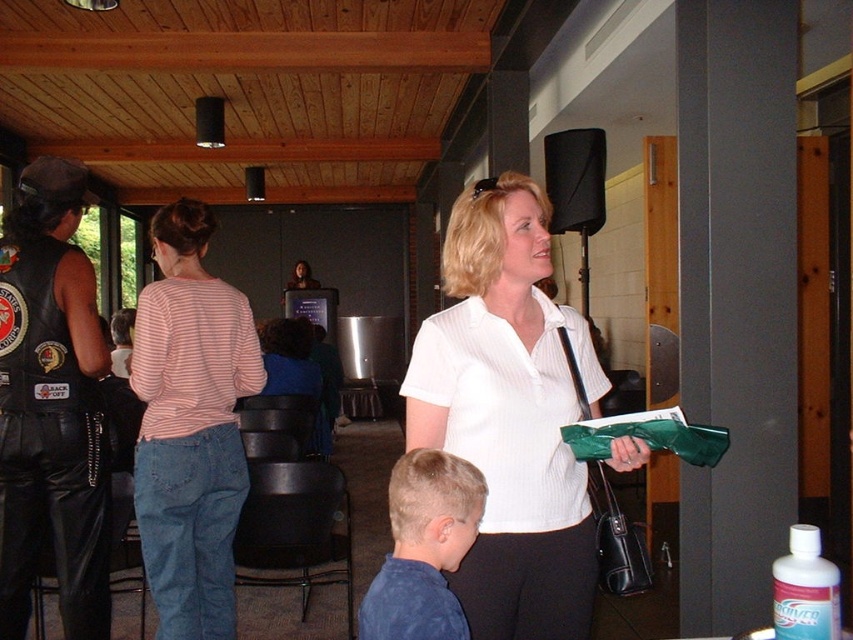
You are organizing a clothing donation drive and need to categorize shirts by size. If you have a standard medium size hanger, which shirt would you place on it first, the white pinstriped shirt at center or the blue cotton shirt at lower center?

The white pinstriped shirt at center is larger in size than the blue cotton shirt at lower center, so you should place the white pinstriped shirt at center on the medium hanger first since it requires a larger size.

You are standing at the speaker stand in the background and want to walk to the point marked as point [584,342]. Which direction should you go relative to the other point at [190,390]?

You should walk towards the direction of point [584,342], which is closer to the camera than point [190,390].